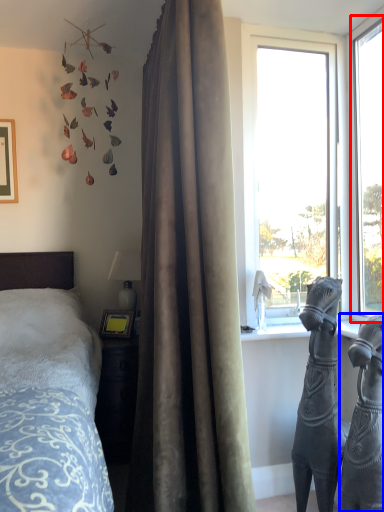
Question: Among these objects, which one is nearest to the camera, window (highlighted by a red box) or sculpture (highlighted by a blue box)?

Choices:
 (A) window
 (B) sculpture

Answer: (B)